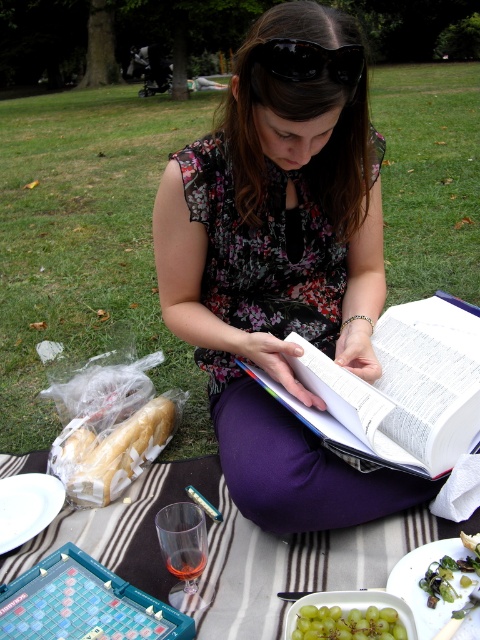
The image size is (480, 640). What do you see at coordinates (121, 452) in the screenshot? I see `white bread at lower left` at bounding box center [121, 452].

Is white bread at lower left to the left of white ceramic plate at lower left from the viewer's perspective?

In fact, white bread at lower left is to the right of white ceramic plate at lower left.

Where is `white bread at lower left`? white bread at lower left is located at coordinates (121, 452).

Does white ceramic plate at lower left appear on the left side of green leafy vegetables at lower right?

Correct, you'll find white ceramic plate at lower left to the left of green leafy vegetables at lower right.

Who is shorter, white ceramic plate at lower left or green leafy vegetables at lower right?

Standing shorter between the two is green leafy vegetables at lower right.

Identify the location of white ceramic plate at lower left. Image resolution: width=480 pixels, height=640 pixels. (26, 506).

Is green grass at lower left taller than green leafy vegetables at lower right?

Correct, green grass at lower left is much taller as green leafy vegetables at lower right.

Is point (408, 147) positioned in front of point (442, 593)?

No, it is not.

You are a GUI agent. You are given a task and a screenshot of the screen. Output one action in this format:
    pyautogui.click(x=<x>, y=<y>)
    Task: Click on the green grass at lower left
    
    Given the screenshot: What is the action you would take?
    pyautogui.click(x=87, y=244)